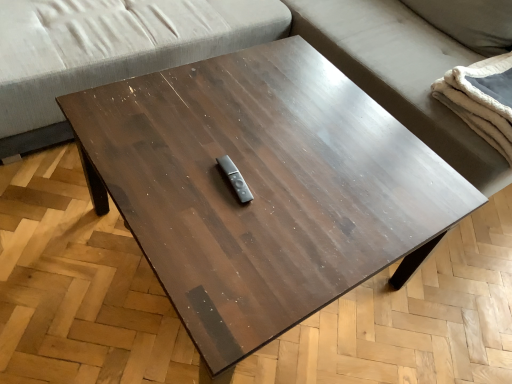
Question: Choose the correct answer: Is gray fabric studio couch at upper center inside gray fabric couch at upper center or outside it?

Choices:
 (A) outside
 (B) inside

Answer: (B)

Question: From the image's perspective, is gray fabric studio couch at upper center located above or below gray fabric couch at upper center?

Choices:
 (A) above
 (B) below

Answer: (B)

Question: Estimate the real-world distances between objects in this image. Which object is farther from the gray fabric couch at upper center?

Choices:
 (A) white fluffy blanket at right
 (B) gray fabric studio couch at upper center

Answer: (A)

Question: Which of these objects is positioned closest to the white fluffy blanket at right?

Choices:
 (A) gray fabric studio couch at upper center
 (B) gray fabric couch at upper center

Answer: (B)